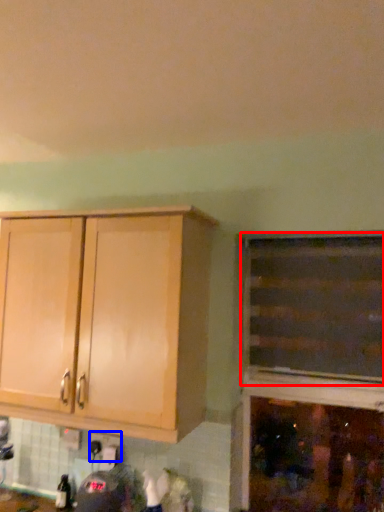
Question: Which point is further to the camera, cabinetry (highlighted by a red box) or electric outlet (highlighted by a blue box)?

Choices:
 (A) cabinetry
 (B) electric outlet

Answer: (B)